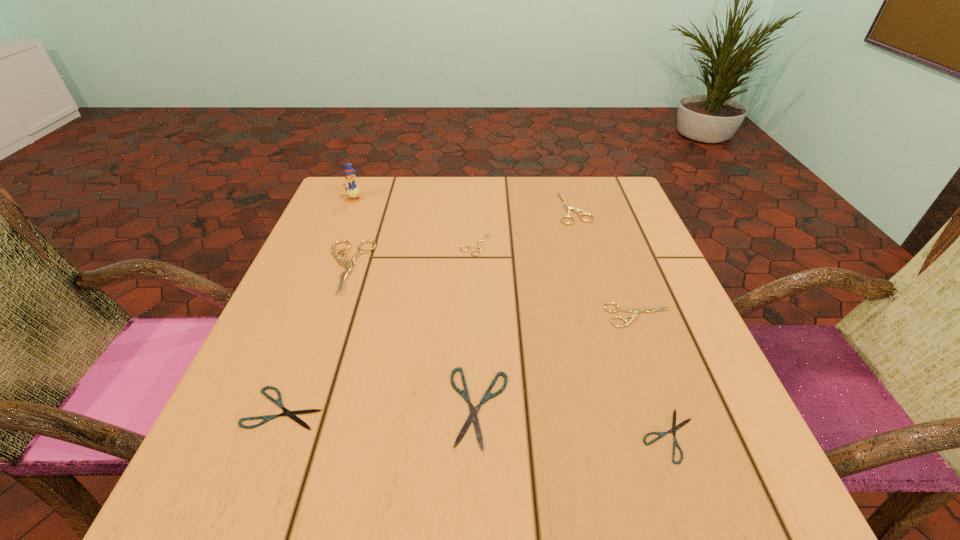
Image resolution: width=960 pixels, height=540 pixels. Identify the location of the second biggest black shears. (291, 414).

Where is `the smallest black shears`? The width and height of the screenshot is (960, 540). the smallest black shears is located at coordinates (674, 428).

Locate an element on the screen. The width and height of the screenshot is (960, 540). the shortest object is located at coordinates (674, 428).

Where is `vacant space located on the face of the duckling, where the monocle is placed`? This screenshot has width=960, height=540. vacant space located on the face of the duckling, where the monocle is placed is located at coordinates (323, 275).

You are a GUI agent. You are given a task and a screenshot of the screen. Output one action in this format:
    pyautogui.click(x=<x>, y=<y>)
    Task: Click on the blank space located on the back of the biggest beige shears
    Image resolution: width=960 pixels, height=540 pixels.
    Given the screenshot: What is the action you would take?
    pyautogui.click(x=368, y=211)

Find the location of a particular element. Image resolution: width=960 pixels, height=540 pixels. free space located on the front of the sixth shortest shears is located at coordinates (x=600, y=295).

Where is `vacant space situated on the front of the fifth shortest object`? The image size is (960, 540). vacant space situated on the front of the fifth shortest object is located at coordinates (712, 509).

I want to click on free space located 0.170m on the right of the second black shears from right to left, so click(x=621, y=407).

At what (x,y) coordinates should I click in order to perform the action: click on free location located on the front of the smallest beige shears. Please return your answer as a coordinate pair (x, y). The width and height of the screenshot is (960, 540). Looking at the image, I should click on (475, 356).

This screenshot has width=960, height=540. What are the coordinates of `free region located 0.290m on the back of the second smallest black shears` in the screenshot? It's located at (337, 269).